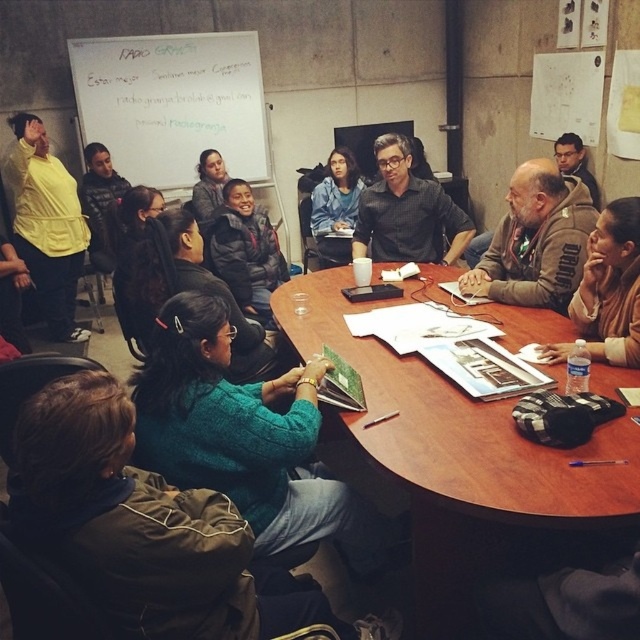
You are standing in front of the large round table and want to reach both the point at coordinates [464,452] and the point at [104,428]. Which point should you move towards first if you want to reach the one closer to you first?

You should move towards point [104,428] first because it is closer to you than point [464,452], which is further away.

You are standing at the entrance of the room and see the matte yellow shirt at upper left and the matte blue sweater at center. If you want to reach both people wearing these clothes, which one should you approach first to minimize the distance walked?

The matte yellow shirt at upper left is closer to you than the matte blue sweater at center, so you should approach the matte yellow shirt at upper left first to minimize the distance walked.

You are standing at the center of the room and see the matte yellow shirt at upper left. Can you estimate the direction you need to look to find it?

The matte yellow shirt at upper left is located at point [45,225], which means it is positioned to the upper left from your current position at the center. You should look towards the upper left direction to find it.